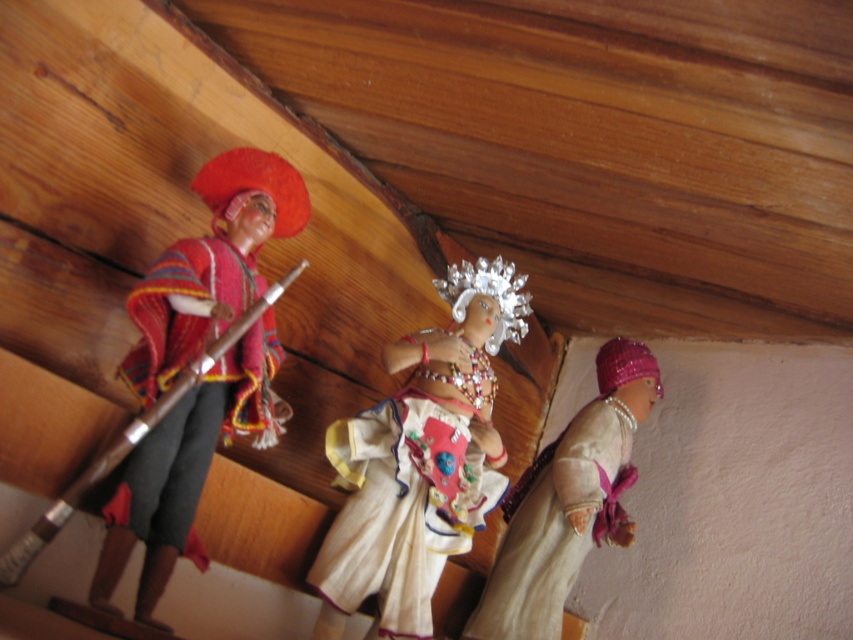
Does white fabric doll at center appear on the right side of knitted woolen poncho at left?

Correct, you'll find white fabric doll at center to the right of knitted woolen poncho at left.

Is point (363, 547) farther from viewer compared to point (142, 349)?

Yes, point (363, 547) is behind point (142, 349).

Between point (395, 566) and point (138, 323), which one is positioned behind?

Point (395, 566)

The image size is (853, 640). I want to click on white fabric doll at center, so click(x=421, y=461).

This screenshot has width=853, height=640. What do you see at coordinates (421, 461) in the screenshot?
I see `white fabric doll at center` at bounding box center [421, 461].

Can you confirm if white fabric doll at center is bigger than beige fabric skirt at lower right?

Indeed, white fabric doll at center has a larger size compared to beige fabric skirt at lower right.

Looking at this image, who is more distant from viewer, (474,353) or (518,525)?

Positioned behind is point (518,525).

Identify the location of white fabric doll at center. This screenshot has width=853, height=640. click(x=421, y=461).

Is beige fabric skirt at lower right taller than knitted woolen poncho at left?

Incorrect, beige fabric skirt at lower right's height is not larger of knitted woolen poncho at left's.

This screenshot has width=853, height=640. Describe the element at coordinates (558, 522) in the screenshot. I see `beige fabric skirt at lower right` at that location.

The height and width of the screenshot is (640, 853). What do you see at coordinates (558, 522) in the screenshot?
I see `beige fabric skirt at lower right` at bounding box center [558, 522].

Where is `beige fabric skirt at lower right`? The width and height of the screenshot is (853, 640). beige fabric skirt at lower right is located at coordinates (558, 522).